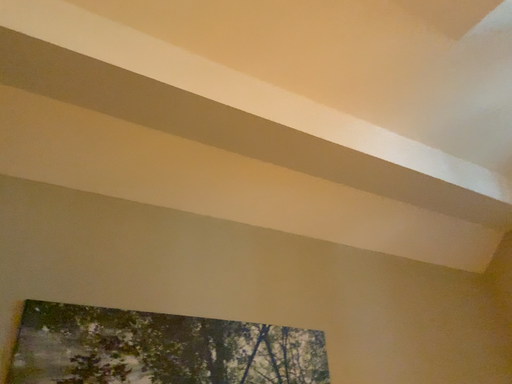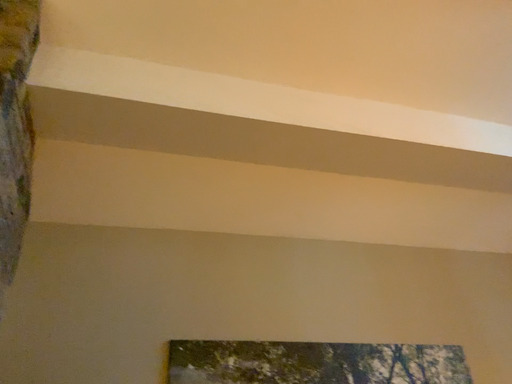
Question: How did the camera likely rotate when shooting the video?

Choices:
 (A) rotated left
 (B) rotated right

Answer: (A)